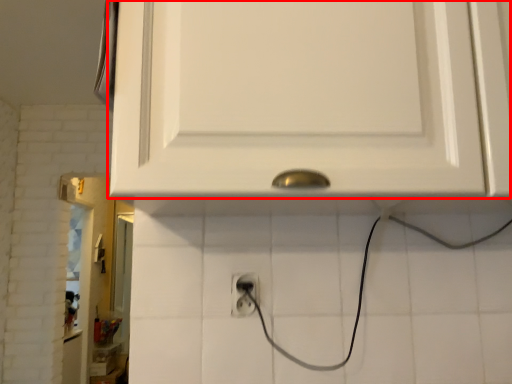
Question: From the image's perspective, where is cabinetry (annotated by the red box) located in relation to power plugs and sockets in the image?

Choices:
 (A) above
 (B) below

Answer: (A)